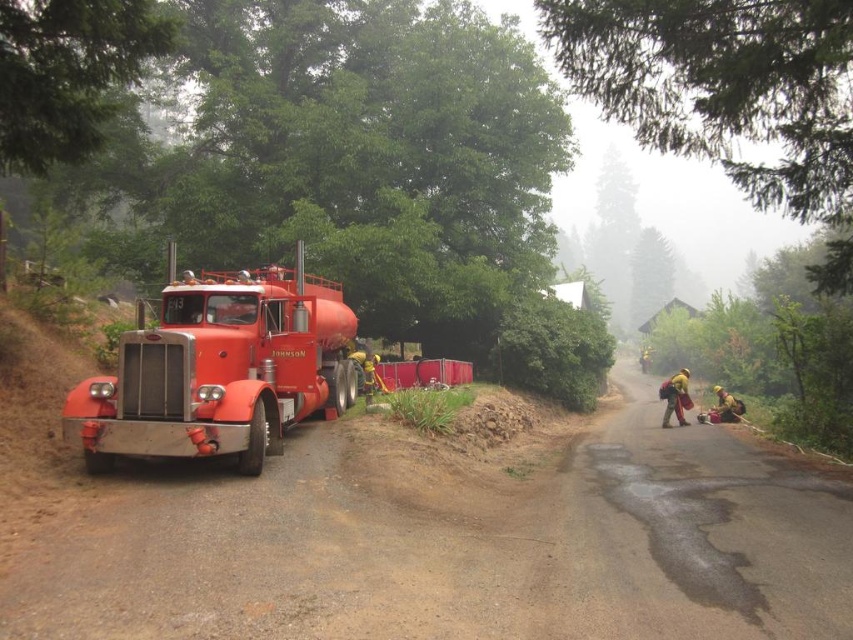
You are driving a delivery van that is 2 meters long and need to pass the shiny red tanker truck at left on the dirt track at left. Based on the scene, can you safely make this maneuver?

The dirt track at left is in front of the shiny red tanker truck at left, so you can safely pass the tanker truck as the track provides enough space in front of it for the van to maneuver.